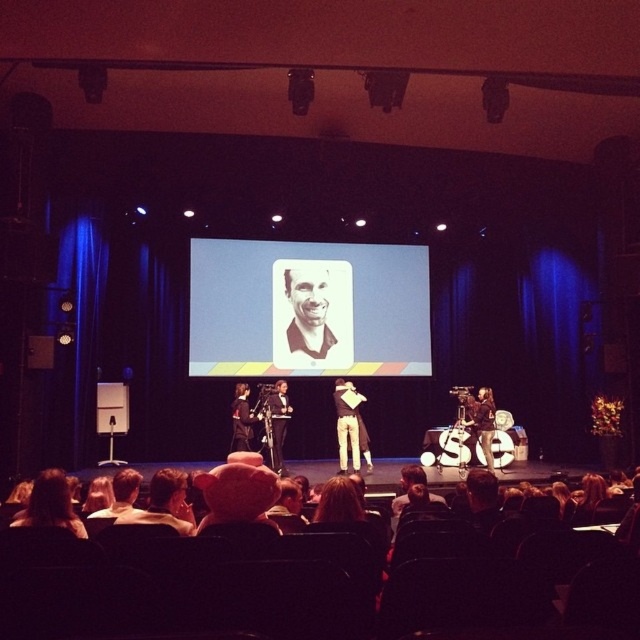
Question: Which point appears farthest from the camera in this image?

Choices:
 (A) (492, 412)
 (B) (237, 449)
 (C) (273, 440)

Answer: (B)

Question: Can you confirm if white cotton shirt at center is positioned above leather jacket at center?

Choices:
 (A) yes
 (B) no

Answer: (A)

Question: Which object appears closest to the camera in this image?

Choices:
 (A) black suit at center
 (B) leather jacket at center
 (C) white paper at center

Answer: (B)

Question: Does white cotton shirt at center appear under matte black suit at center?

Choices:
 (A) no
 (B) yes

Answer: (B)

Question: Which point is closer to the camera?

Choices:
 (A) white cotton shirt at center
 (B) white paper at center

Answer: (A)

Question: Is leather jacket at center to the left of matte black suit at center from the viewer's perspective?

Choices:
 (A) yes
 (B) no

Answer: (B)